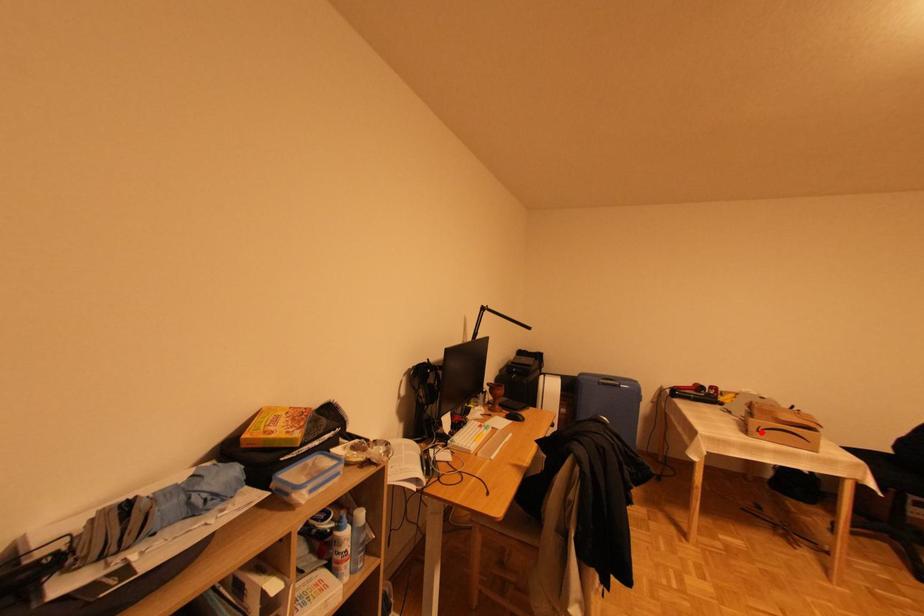
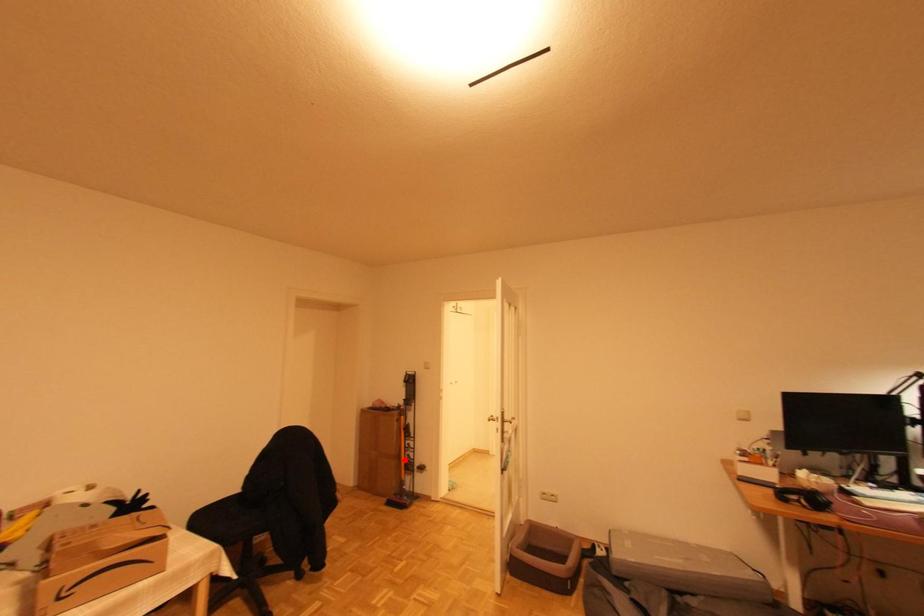
I am providing you with two images of the same scene from different viewpoints. A red point is marked on the first image and another point is marked on the second image. Is the marked point in image1 the same physical position as the marked point in image2?

No